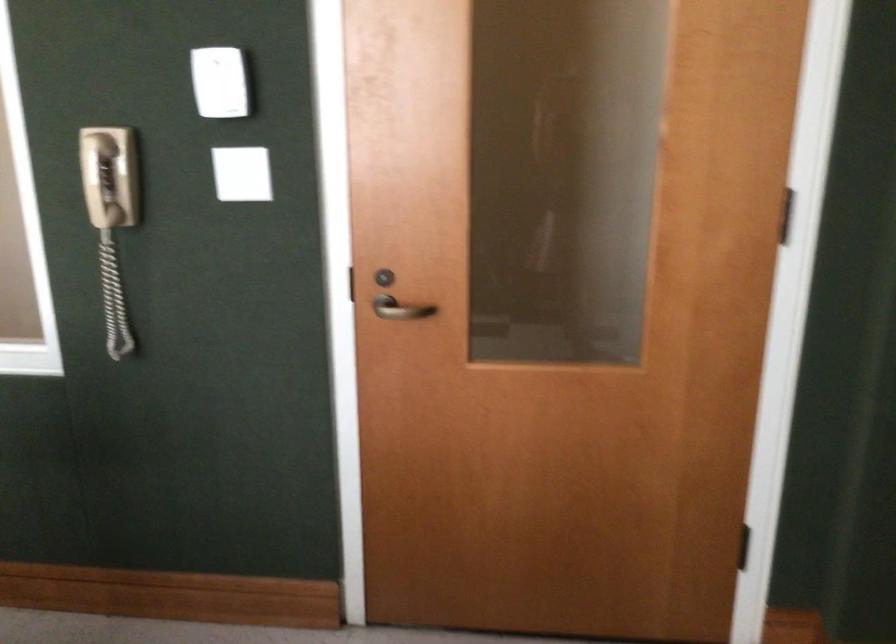
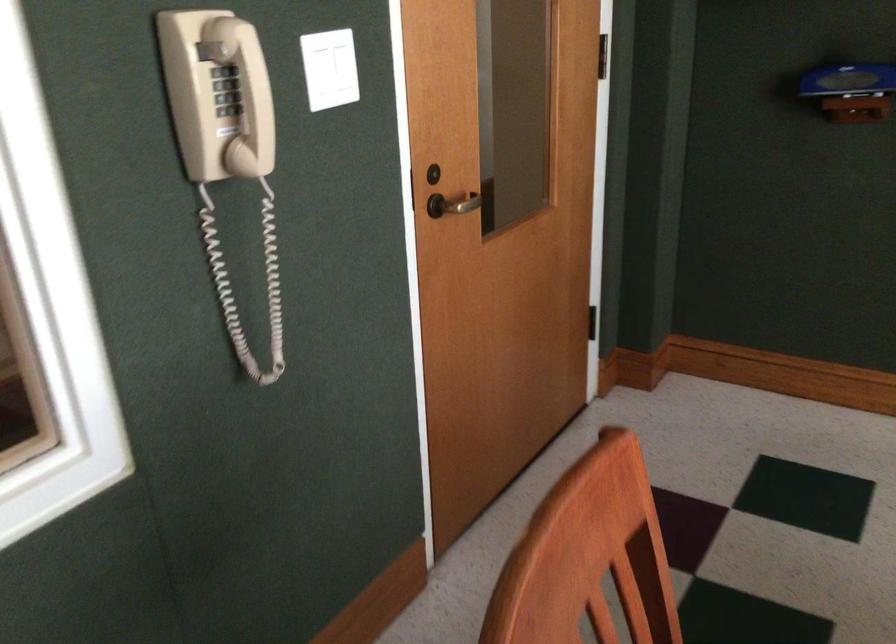
The point at (383, 315) is marked in the first image. Where is the corresponding point in the second image?

(458, 204)